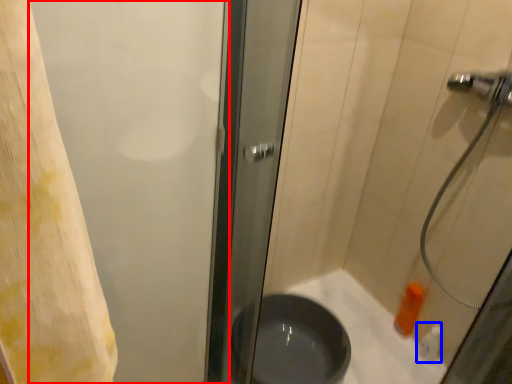
Question: Which object is closer to the camera taking this photo, screen door (highlighted by a red box) or toiletry (highlighted by a blue box)?

Choices:
 (A) screen door
 (B) toiletry

Answer: (A)